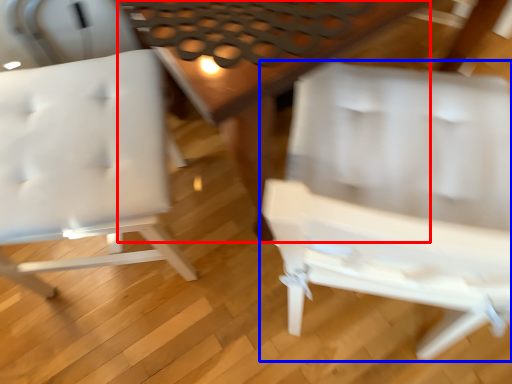
Question: Which object appears farthest to the camera in this image, table (highlighted by a red box) or chair (highlighted by a blue box)?

Choices:
 (A) table
 (B) chair

Answer: (A)